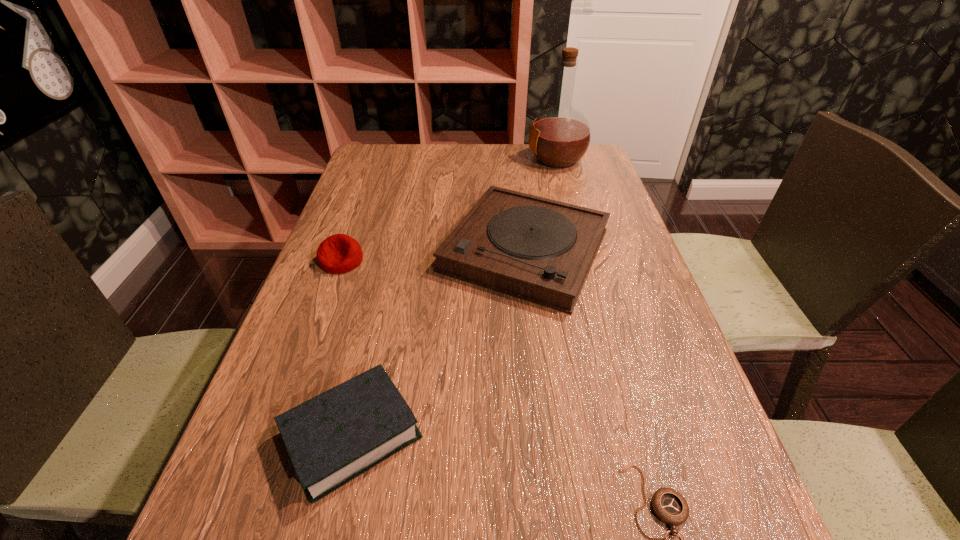
Identify the location of object that is the third closest one to the beanbag. This screenshot has width=960, height=540. (560, 136).

Locate which object is the second closest to the phonograph record. Please provide its 2D coordinates. Your answer should be formatted as a tuple, i.e. [(x, y)], where the tuple contains the x and y coordinates of a point satisfying the conditions above.

[(560, 136)]

Locate an element on the screen. The height and width of the screenshot is (540, 960). free space that satisfies the following two spatial constraints: 1. on the front label of the liquor; 2. on the front side of the Bible is located at coordinates (633, 434).

The height and width of the screenshot is (540, 960). Identify the location of vacant space that satisfies the following two spatial constraints: 1. on the seat area of the beanbag; 2. on the left side of the Bible. (x=278, y=434).

The width and height of the screenshot is (960, 540). What are the coordinates of `free space that satisfies the following two spatial constraints: 1. on the front label of the farthest object; 2. on the seat area of the beanbag` in the screenshot? It's located at (585, 261).

What are the coordinates of `vacant point that satisfies the following two spatial constraints: 1. on the seat area of the fourth tallest object; 2. on the left side of the beanbag` in the screenshot? It's located at (278, 434).